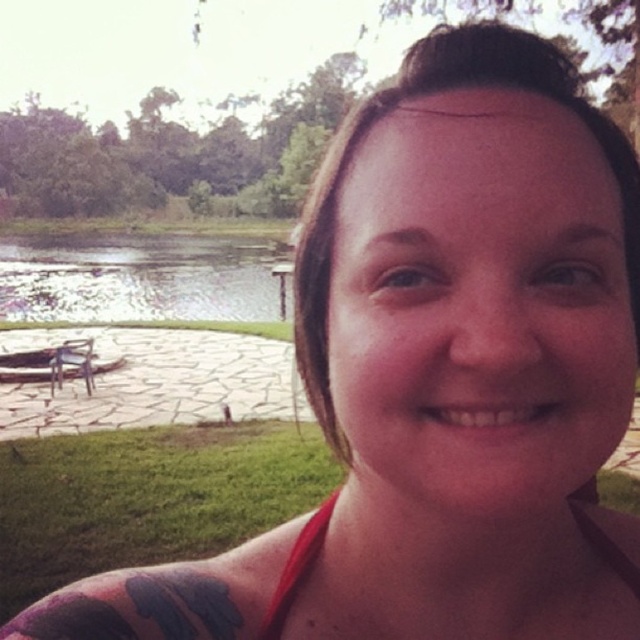
Question: Does clear water at lake left appear on the left side of red fabric bikini top at lower center?

Choices:
 (A) yes
 (B) no

Answer: (A)

Question: Is clear water at lake left positioned before red fabric bikini top at lower center?

Choices:
 (A) no
 (B) yes

Answer: (A)

Question: Which point is closer to the camera?

Choices:
 (A) clear water at lake left
 (B) red fabric bikini top at lower center

Answer: (B)

Question: Which of the following is the closest to the observer?

Choices:
 (A) clear water at lake left
 (B) red fabric bikini top at lower center

Answer: (B)

Question: Is the position of clear water at lake left less distant than that of red fabric bikini top at lower center?

Choices:
 (A) no
 (B) yes

Answer: (A)